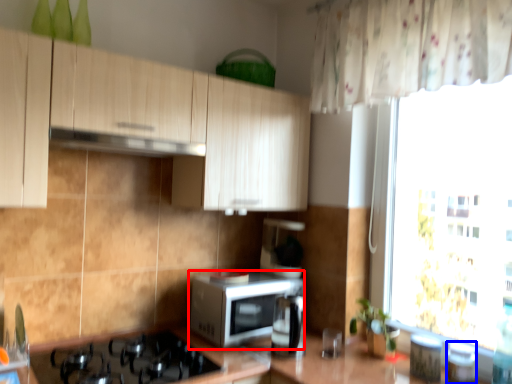
Question: Which of the following is the closest to the observer, microwave oven (highlighted by a red box) or appliance (highlighted by a blue box)?

Choices:
 (A) microwave oven
 (B) appliance

Answer: (B)